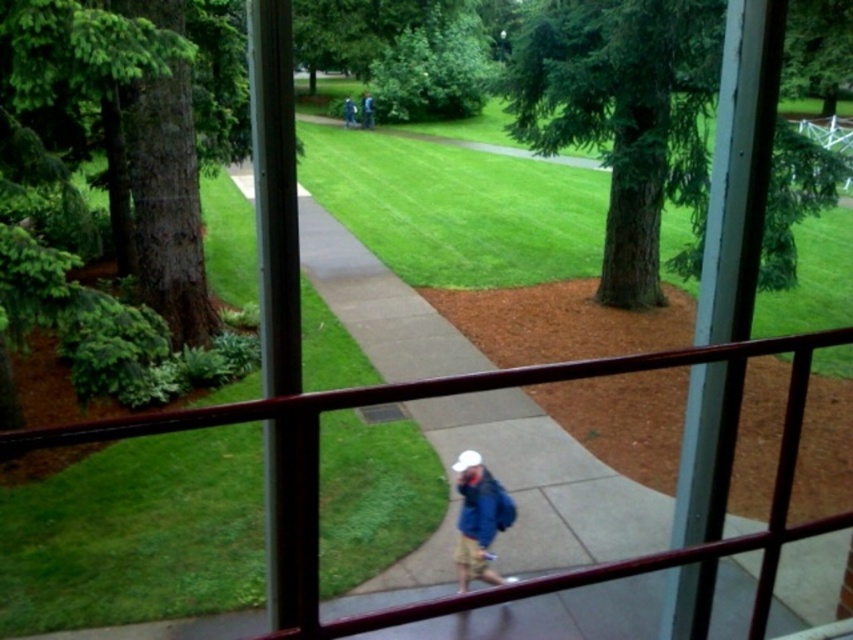
The height and width of the screenshot is (640, 853). What do you see at coordinates (622, 115) in the screenshot?
I see `green textured tree at center` at bounding box center [622, 115].

Is green textured tree at center thinner than blue denim jacket at center?

In fact, green textured tree at center might be wider than blue denim jacket at center.

Which is behind, point (509, 61) or point (462, 476)?

Positioned behind is point (509, 61).

Find the location of `green textured tree at center`. green textured tree at center is located at coordinates (622, 115).

Who is higher up, green leafy tree at upper center or blue denim jacket at center?

green leafy tree at upper center is higher up.

Does green leafy tree at upper center have a lesser height compared to blue denim jacket at center?

No.

Measure the distance between green leafy tree at upper center and camera.

They are 26.69 meters apart.

Locate an element on the screen. The image size is (853, 640). green leafy tree at upper center is located at coordinates (433, 68).

Is point (567, 28) positioned in front of point (462, 90)?

Yes, point (567, 28) is in front of point (462, 90).

Does green textured tree at center have a greater height compared to green leafy tree at upper center?

No, green textured tree at center is not taller than green leafy tree at upper center.

Between point (552, 108) and point (398, 109), which one is positioned behind?

Positioned behind is point (398, 109).

Where is `green textured tree at center`? The height and width of the screenshot is (640, 853). green textured tree at center is located at coordinates (622, 115).